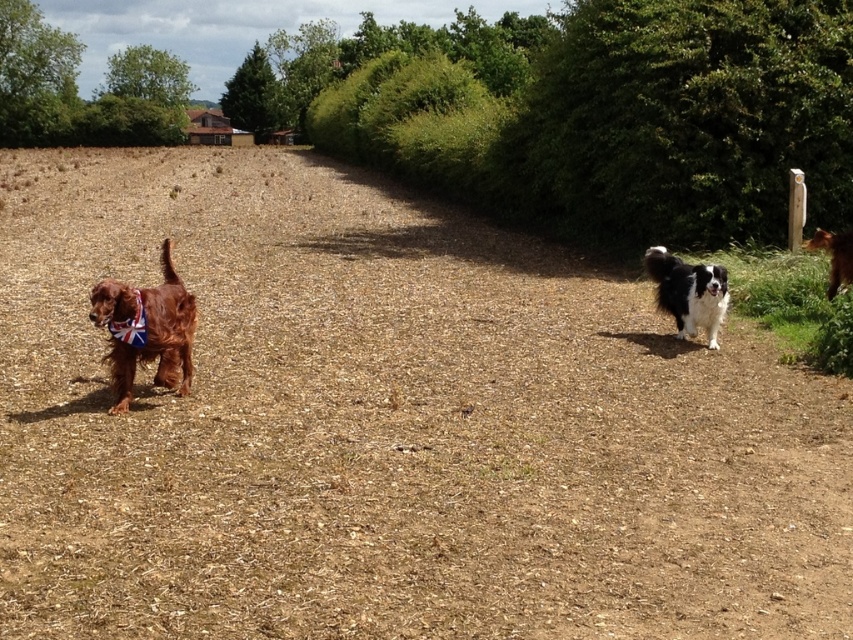
You are a photographer trying to capture both the black and white fur at right and the brown furry dog at right in a single shot. Since you want to ensure both are fully visible, which dog should you focus on to avoid cropping the taller one out of the frame?

The black and white fur at right is much taller than the brown furry dog at right, so you should focus on the black and white fur at right to ensure it fits entirely within the frame.

You are a photographer trying to capture both the shiny brown dog at left and the black and white fur at right in a single frame. Which dog should you adjust your camera angle to focus on first if you want to ensure both are in the frame without moving your position?

The shiny brown dog at left is wider than the black and white fur at right, so you should focus on the shiny brown dog at left first to ensure it fits within the frame.